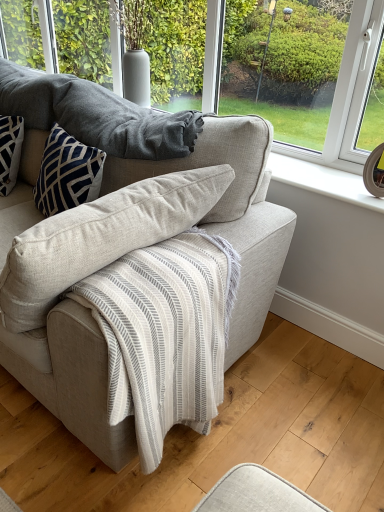
Locate an element on the screen. Image resolution: width=384 pixels, height=512 pixels. light beige fabric couch at center is located at coordinates (231, 213).

Does textured wool blanket at upper center appear on the right side of light beige fabric couch at center?

Yes, textured wool blanket at upper center is to the right of light beige fabric couch at center.

Does textured wool blanket at upper center have a greater height compared to light beige fabric couch at center?

No.

In the image, is textured wool blanket at upper center positioned in front of or behind light beige fabric couch at center?

textured wool blanket at upper center is positioned farther from the viewer than light beige fabric couch at center.

Is transparent glass window at upper center thinner than textured wool blanket at upper center?

Yes.

Does transparent glass window at upper center appear on the right side of textured wool blanket at upper center?

Correct, you'll find transparent glass window at upper center to the right of textured wool blanket at upper center.

Considering the sizes of transparent glass window at upper center and textured wool blanket at upper center in the image, is transparent glass window at upper center bigger or smaller than textured wool blanket at upper center?

Considering their sizes, transparent glass window at upper center takes up more space than textured wool blanket at upper center.

Which object is further away from the camera taking this photo, transparent glass window at upper center or textured wool blanket at upper center?

Positioned behind is transparent glass window at upper center.

From the image's perspective, which object appears higher, light beige fabric couch at center or textured wool blanket at upper center?

textured wool blanket at upper center appears higher in the image.

Find the location of `studio couch that is under the textured wool blanket at upper center (from a real-world perspective)`. studio couch that is under the textured wool blanket at upper center (from a real-world perspective) is located at coordinates (231, 213).

From the picture: Can you tell me how much light beige fabric couch at center and textured wool blanket at upper center differ in facing direction?

The facing directions of light beige fabric couch at center and textured wool blanket at upper center are 0.000438 degrees apart.

Considering the sizes of objects light beige fabric couch at center and textured wool blanket at upper center in the image provided, who is shorter, light beige fabric couch at center or textured wool blanket at upper center?

textured wool blanket at upper center is shorter.

How different are the orientations of transparent glass window at upper center and light beige fabric couch at center in degrees?

They differ by 0.371 degrees in their facing directions.

Considering the relative positions of transparent glass window at upper center and light beige fabric couch at center in the image provided, is transparent glass window at upper center to the right of light beige fabric couch at center from the viewer's perspective?

Yes.

Is transparent glass window at upper center closer to the viewer compared to light beige fabric couch at center?

No, transparent glass window at upper center is further to the viewer.

Which is in front, point (61, 11) or point (232, 362)?

Point (232, 362)

Which is more to the right, light beige fabric couch at center or transparent glass window at upper center?

Positioned to the right is transparent glass window at upper center.

In terms of height, does light beige fabric couch at center look taller or shorter compared to transparent glass window at upper center?

Considering their sizes, light beige fabric couch at center has more height than transparent glass window at upper center.

Would you say light beige fabric couch at center contains transparent glass window at upper center?

No, transparent glass window at upper center is located outside of light beige fabric couch at center.

Is light beige fabric couch at center bigger or smaller than transparent glass window at upper center?

Considering their sizes, light beige fabric couch at center takes up more space than transparent glass window at upper center.

From the image's perspective, does textured wool blanket at upper center appear lower than transparent glass window at upper center?

Yes, from the image's perspective, textured wool blanket at upper center is beneath transparent glass window at upper center.

I want to click on gray below the transparent glass window at upper center (from the image's perspective), so click(96, 115).

Find the location of a particular element. Image resolution: width=384 pixels, height=512 pixels. studio couch directly beneath the textured wool blanket at upper center (from a real-world perspective) is located at coordinates (231, 213).

At what (x,y) coordinates should I click in order to perform the action: click on gray in front of the transparent glass window at upper center. Please return your answer as a coordinate pair (x, y). Image resolution: width=384 pixels, height=512 pixels. Looking at the image, I should click on (96, 115).

From the image, which object appears to be farther from transparent glass window at upper center, textured wool blanket at upper center or light beige fabric couch at center?

light beige fabric couch at center.

Considering their positions, is light beige fabric couch at center positioned further to textured wool blanket at upper center than transparent glass window at upper center?

Among the two, transparent glass window at upper center is located further to textured wool blanket at upper center.

When comparing their distances from light beige fabric couch at center, does textured wool blanket at upper center or transparent glass window at upper center seem further?

transparent glass window at upper center.

From the image, which object appears to be farther from light beige fabric couch at center, transparent glass window at upper center or textured wool blanket at upper center?

transparent glass window at upper center.

Considering their positions, is transparent glass window at upper center positioned closer to textured wool blanket at upper center than light beige fabric couch at center?

Based on the image, light beige fabric couch at center appears to be nearer to textured wool blanket at upper center.

Looking at this image, which object lies further to the anchor point transparent glass window at upper center, light beige fabric couch at center or textured wool blanket at upper center?

Based on the image, light beige fabric couch at center appears to be further to transparent glass window at upper center.

Locate an element on the screen. Image resolution: width=384 pixels, height=512 pixels. gray between transparent glass window at upper center and light beige fabric couch at center in the up-down direction is located at coordinates (96, 115).